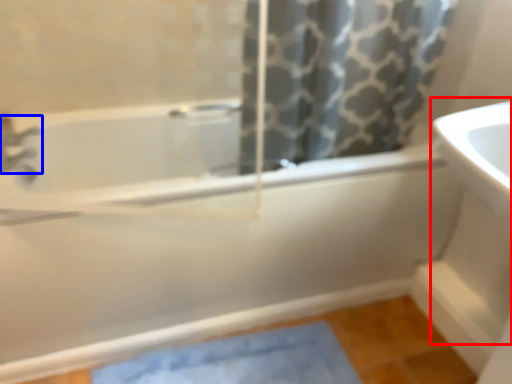
Question: Among these objects, which one is farthest to the camera, sink (highlighted by a red box) or tap (highlighted by a blue box)?

Choices:
 (A) sink
 (B) tap

Answer: (B)